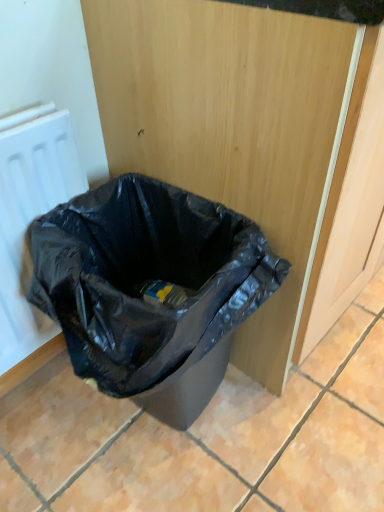
I want to click on vacant space underneath black plastic bag at lower left (from a real-world perspective), so click(x=154, y=425).